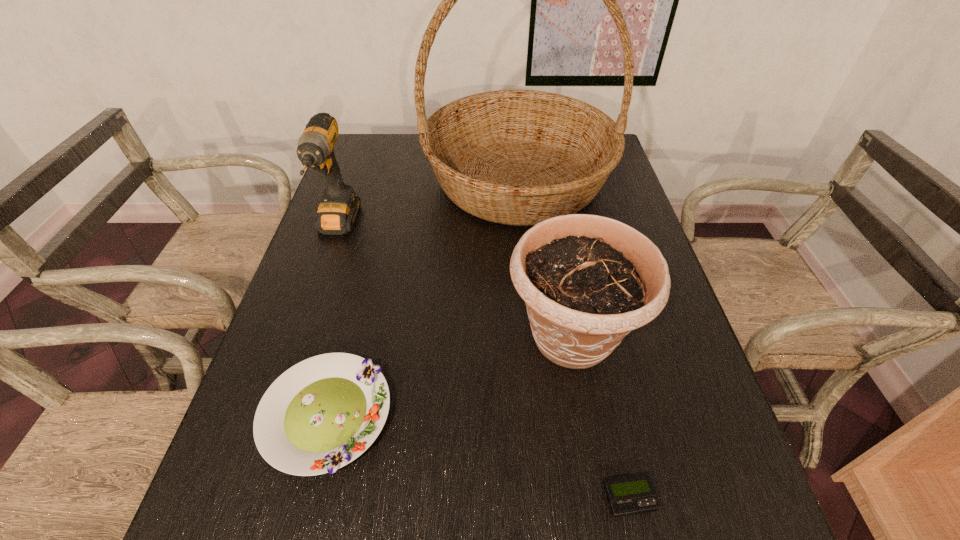
Locate an element on the screen. basket is located at coordinates (517, 157).

Locate an element on the screen. The height and width of the screenshot is (540, 960). drill is located at coordinates (338, 208).

Locate an element on the screen. flowerpot is located at coordinates (587, 281).

This screenshot has height=540, width=960. In order to click on salad plate in this screenshot , I will do `click(321, 414)`.

Find the location of a particular element. This screenshot has height=540, width=960. the shortest object is located at coordinates (631, 495).

Where is `vacant space situated on the front of the tallest object`? The width and height of the screenshot is (960, 540). vacant space situated on the front of the tallest object is located at coordinates point(528,275).

Identify the location of free region located 0.340m with the drill bit of the fourth shortest object facing forward. The width and height of the screenshot is (960, 540). (288, 367).

This screenshot has width=960, height=540. In order to click on free location located 0.190m on the front of the flowerpot in this screenshot , I will do `click(602, 502)`.

Find the location of a particular element. free point located 0.080m on the front of the salad plate is located at coordinates (296, 534).

Locate an element on the screen. vacant area situated on the right of the beeper is located at coordinates (750, 498).